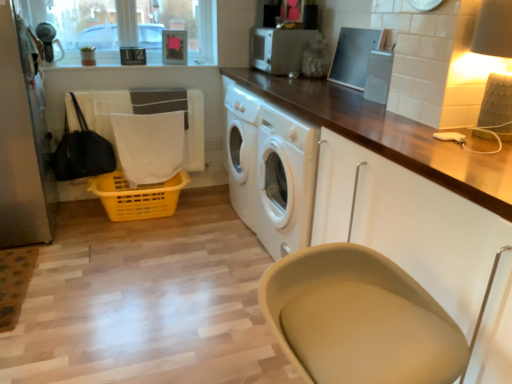
Question: Based on their sizes in the image, would you say white fabric at lower left is bigger or smaller than satin silver toaster at upper center, the second appliance ordered from the bottom?

Choices:
 (A) big
 (B) small

Answer: (B)

Question: In terms of height, does white fabric at lower left look taller or shorter compared to satin silver toaster at upper center, placed as the 1th appliance when sorted from top to bottom?

Choices:
 (A) short
 (B) tall

Answer: (B)

Question: Which object is positioned farthest from the clear plastic container at upper center, positioned as the 1th appliance in right-to-left order?

Choices:
 (A) white fabric laundry at left
 (B) yellow plastic basket at lower left
 (C) white fabric at lower left
 (D) beige fabric feeding chair at lower center
 (E) satin silver toaster at upper center, the first appliance from the left

Answer: (A)

Question: Which of these objects is positioned farthest from the beige fabric feeding chair at lower center?

Choices:
 (A) matte cream lampshade at upper right
 (B) yellow plastic basket at lower left
 (C) white fabric laundry at left
 (D) satin silver toaster at upper center, the first appliance from the left
 (E) satin silver screen door at left

Answer: (C)